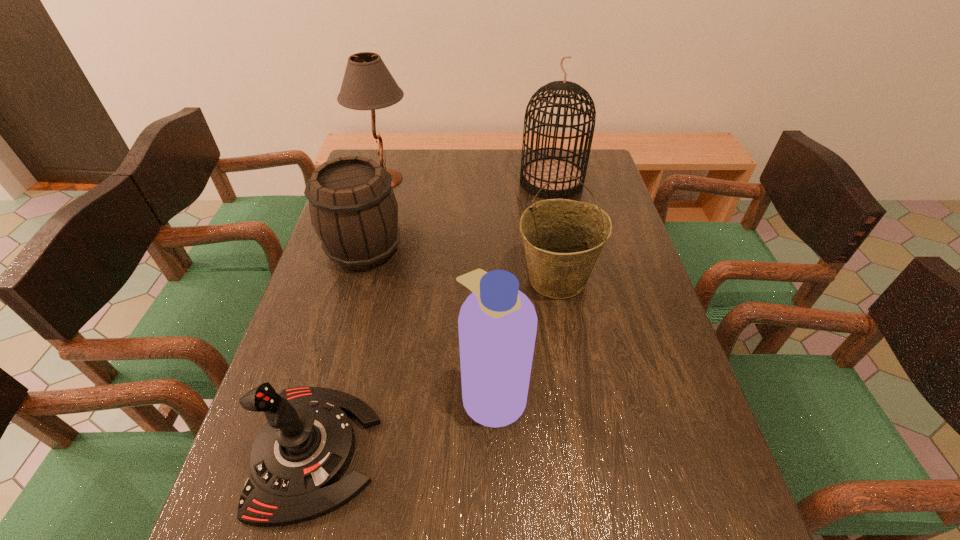
In order to click on vacant space in between the shortest object and the right wine bucket in this screenshot , I will do `click(436, 365)`.

Find the location of a particular element. This screenshot has width=960, height=540. unoccupied position between the taller wine bucket and the table lamp is located at coordinates (470, 229).

The image size is (960, 540). I want to click on vacant area that lies between the shampoo and the shortest object, so click(404, 422).

This screenshot has width=960, height=540. In order to click on empty location between the table lamp and the birdcage in this screenshot , I will do `click(468, 180)`.

Image resolution: width=960 pixels, height=540 pixels. Find the location of `vacant area that lies between the shorter wine bucket and the birdcage`. vacant area that lies between the shorter wine bucket and the birdcage is located at coordinates (458, 215).

Where is `object that is the fifth closest to the shampoo`? This screenshot has height=540, width=960. object that is the fifth closest to the shampoo is located at coordinates (367, 84).

Locate which object is the closest to the shampoo. Please provide its 2D coordinates. Your answer should be formatted as a tuple, i.e. [(x, y)], where the tuple contains the x and y coordinates of a point satisfying the conditions above.

[(562, 238)]

The width and height of the screenshot is (960, 540). I want to click on free space that satisfies the following two spatial constraints: 1. on the front-facing side of the right wine bucket; 2. on the left side of the table lamp, so click(x=357, y=279).

The height and width of the screenshot is (540, 960). I want to click on vacant region that satisfies the following two spatial constraints: 1. on the front-facing side of the right wine bucket; 2. on the left side of the table lamp, so click(x=357, y=279).

The image size is (960, 540). In order to click on free point that satisfies the following two spatial constraints: 1. on the front side of the shampoo; 2. on the handle side of the joystick in this screenshot , I will do `click(494, 451)`.